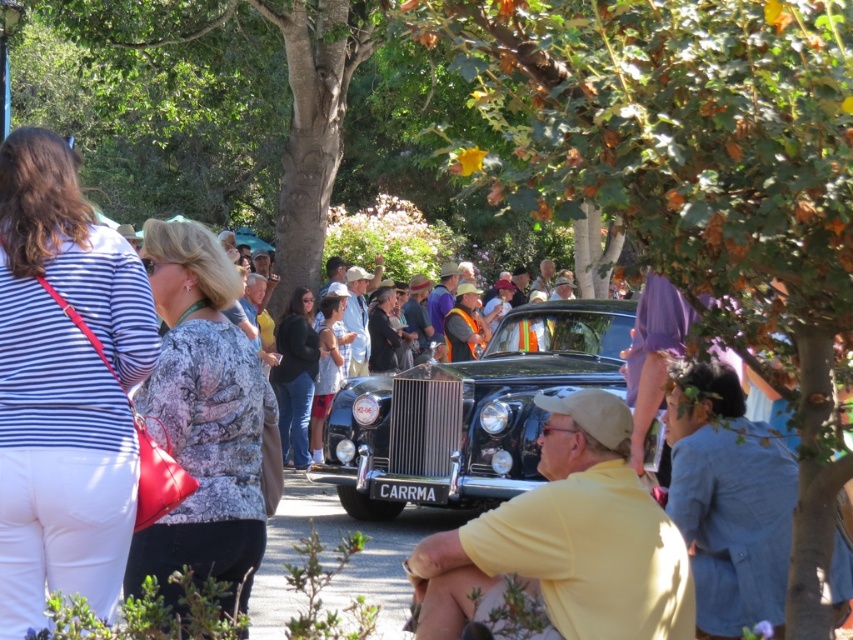
Is shiny black car at center bigger than printed fabric blouse at center?

Yes.

Who is more distant from viewer, (614,333) or (259,522)?

Positioned behind is point (614,333).

This screenshot has height=640, width=853. I want to click on shiny black car at center, so click(x=467, y=412).

Find the location of `shiny black car at center`. shiny black car at center is located at coordinates (467, 412).

Is point (39, 131) positioned in front of point (219, 269)?

That is True.

Is striped fabric shirt at left taller than printed fabric blouse at center?

Yes.

Between point (49, 492) and point (149, 380), which one is positioned in front?

Point (49, 492) is in front.

Locate an element on the screen. Image resolution: width=853 pixels, height=640 pixels. striped fabric shirt at left is located at coordinates (64, 387).

Identify the location of green leafy tree at upper center. (693, 177).

Does point (618, 188) come behind point (601, 476)?

No.

You are a GUI agent. You are given a task and a screenshot of the screen. Output one action in this format:
    pyautogui.click(x=<x>, y=<y>)
    Task: Click on the green leafy tree at upper center
    Image resolution: width=853 pixels, height=640 pixels.
    Given the screenshot: What is the action you would take?
    pyautogui.click(x=693, y=177)